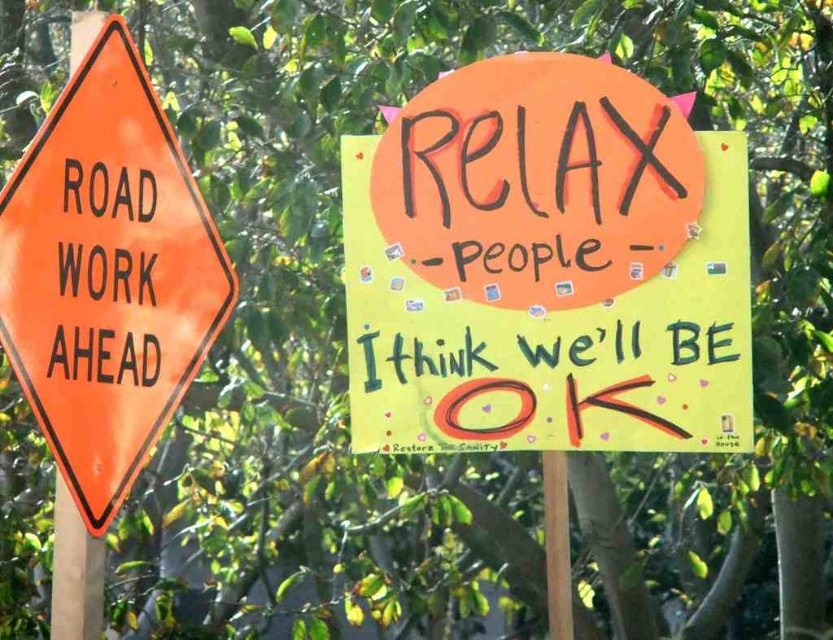
You are a delivery person trying to secure a package to the back of your truck. You have a strap that can only stretch to 1.2 meters. Looking at the image, can you determine if the yellow paper poster at upper right and the orange plastic signpost at left can both fit side by side along the length of the strap?

The yellow paper poster at upper right might be wider than orange plastic signpost at left, so combined their total width could exceed 1.2 meters. It is uncertain if they can both fit side by side along the strap.